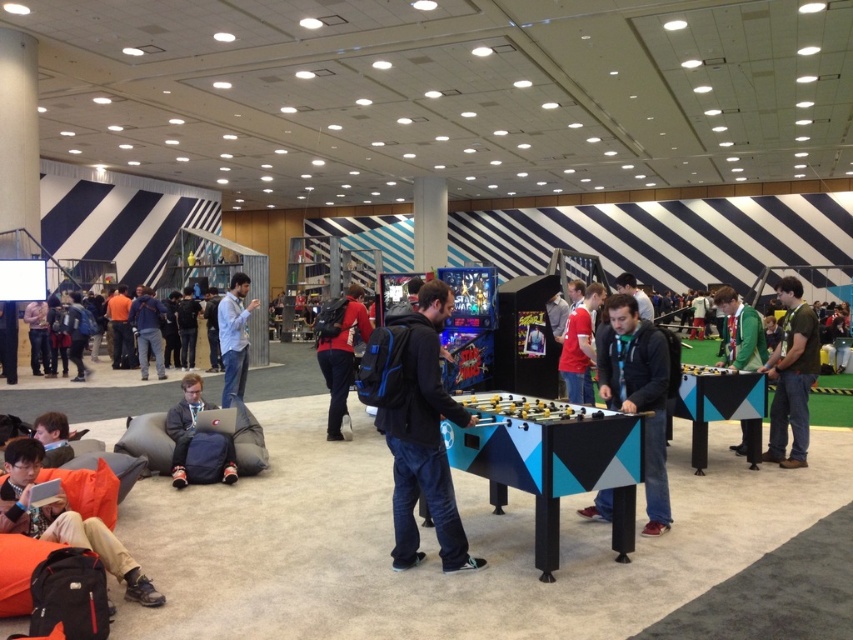
You are at the event and want to sit on the orange fabric bean bag at lower left. To reach it, you need to walk from the entrance which is near the matte black foosball table at center. Which direction should you move relative to the foosball table?

The matte black foosball table at center is to the right of orange fabric bean bag at lower left, so you should move to the left relative to the foosball table to reach the bean bag.

You are at the event and see the matte black backpack at center and the red jersey at center. Which one is located to the left?

The matte black backpack at center is positioned to the left of the red jersey at center.

From the picture: You are standing at the center of the event space and want to grab a drink from the refreshment area located behind the matte black foosball table at center. However, there is a light blue shirt at center blocking your path. Can you walk around them without needing to ask for assistance?

The distance between the matte black foosball table at center and the light blue shirt at center is 13.84 feet. Since the light blue shirt at center is 13.84 feet away from the table, you have enough space to walk around them without needing to ask for assistance.